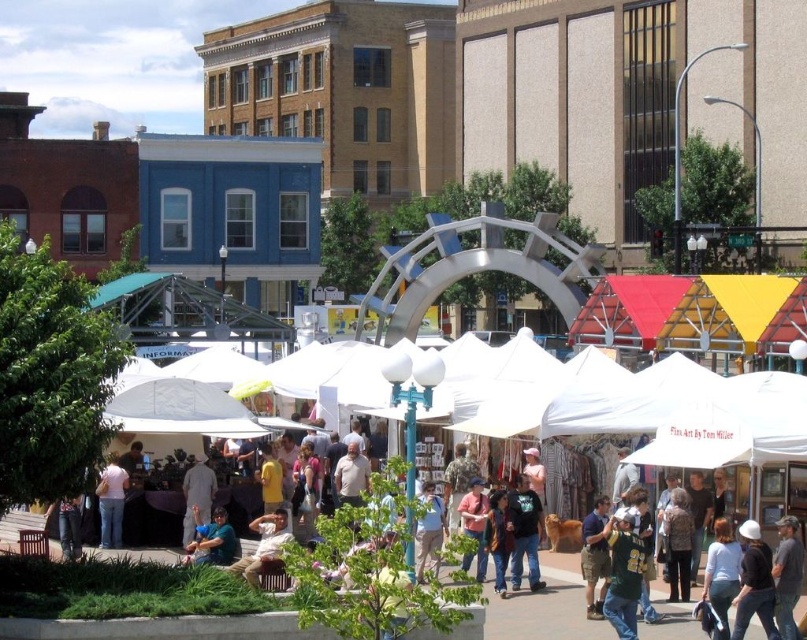
Can you confirm if dark blue t-shirt at center is shorter than blue denim shirt at center?

No, dark blue t-shirt at center is not shorter than blue denim shirt at center.

How far apart are dark blue t-shirt at center and blue denim shirt at center?

7.23 meters

Who is more distant from viewer, (523, 529) or (231, 528)?

The point (523, 529) is behind.

The width and height of the screenshot is (807, 640). Identify the location of dark blue t-shirt at center. (525, 532).

Can you confirm if brown leather jacket at center is smaller than pink cotton shirt at lower left?

Indeed, brown leather jacket at center has a smaller size compared to pink cotton shirt at lower left.

Can you confirm if brown leather jacket at center is bigger than pink cotton shirt at lower left?

No, brown leather jacket at center is not bigger than pink cotton shirt at lower left.

Where is `brown leather jacket at center`? This screenshot has width=807, height=640. brown leather jacket at center is located at coordinates (594, 556).

I want to click on brown leather jacket at center, so click(x=594, y=556).

Is point (622, 576) less distant than point (103, 518)?

Yes, it is.

Is green jersey at center positioned in front of pink cotton shirt at lower left?

Yes, it is in front of pink cotton shirt at lower left.

Between point (630, 602) and point (99, 472), which one is positioned in front?

Positioned in front is point (630, 602).

Locate an element on the screen. The height and width of the screenshot is (640, 807). green jersey at center is located at coordinates (622, 573).